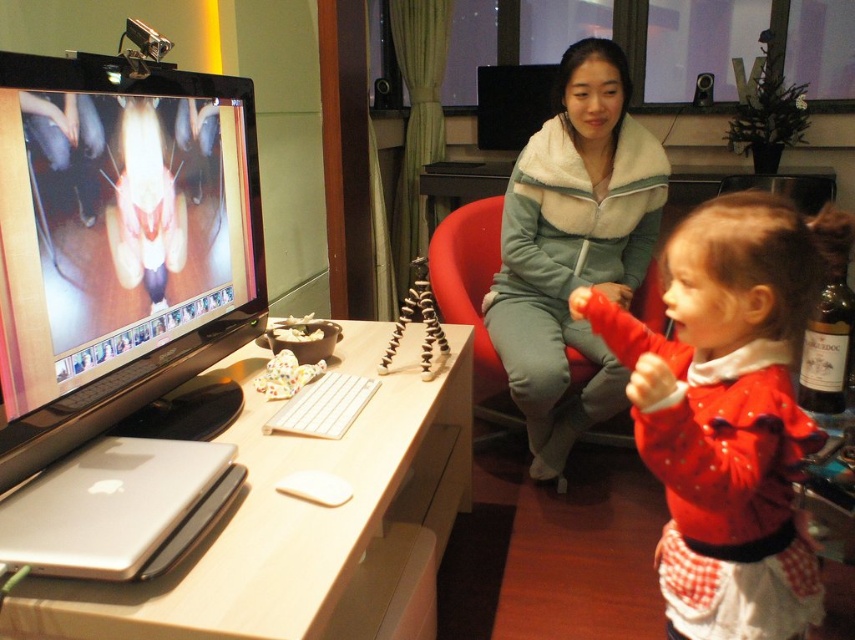
Question: Where is black matte computer monitor at upper center located in relation to brown glass bottle at right in the image?

Choices:
 (A) left
 (B) right

Answer: (A)

Question: Which object is closer to the camera taking this photo?

Choices:
 (A) red velvet dress at lower right
 (B) light green fleece jacket at center
 (C) red fabric swivel chair at center

Answer: (A)

Question: Which point is farther from the camera taking this photo?

Choices:
 (A) (514, 248)
 (B) (622, 435)
 (C) (700, 477)

Answer: (B)

Question: Does red velvet dress at lower right have a smaller size compared to rubberized black tripod at center?

Choices:
 (A) yes
 (B) no

Answer: (B)

Question: Which point is closer to the camera?

Choices:
 (A) black matte computer monitor at upper center
 (B) brown glass bottle at right
 (C) white wood table at lower left
 (D) light green fleece jacket at center

Answer: (C)

Question: Can you confirm if brown glass bottle at right is bigger than rubberized black tripod at center?

Choices:
 (A) yes
 (B) no

Answer: (B)